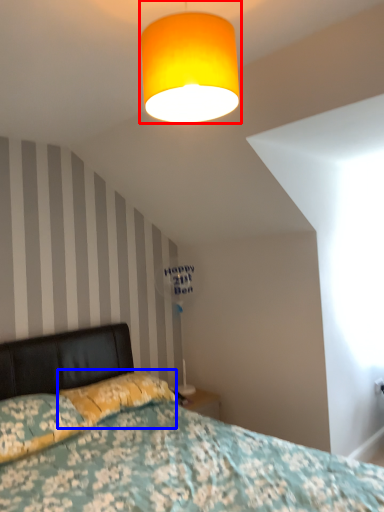
Question: Which point is closer to the camera, lamp (highlighted by a red box) or pillow (highlighted by a blue box)?

Choices:
 (A) lamp
 (B) pillow

Answer: (A)